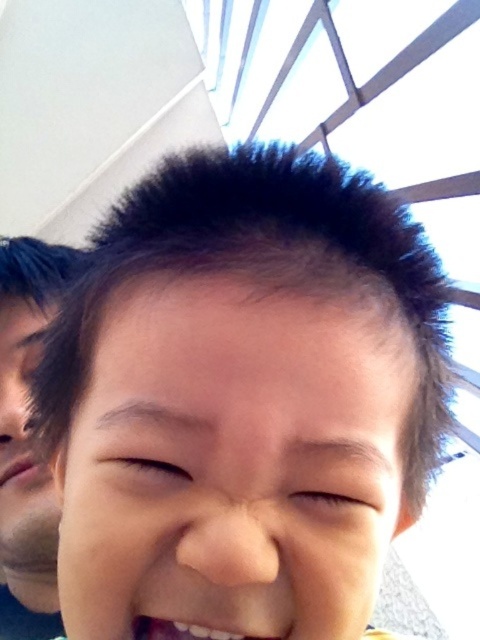
You are a photographer trying to adjust the lighting for a portrait. You notice the subject has dark brown hair at center located at point (242,397). Based on the scene description, where should you position the light to avoid harsh shadows on the subject?

The dark brown hair at center is located at point (242,397). To avoid harsh shadows, position the light source in the direction opposite to the bright, overexposed sky mentioned in the scene. This will help balance the lighting and reduce contrast.

Looking at the child in the image, which object is larger when comparing the dark brown hair at center and the pink matte lips at lower left?

The dark brown hair at center is bigger than the pink matte lips at lower left.